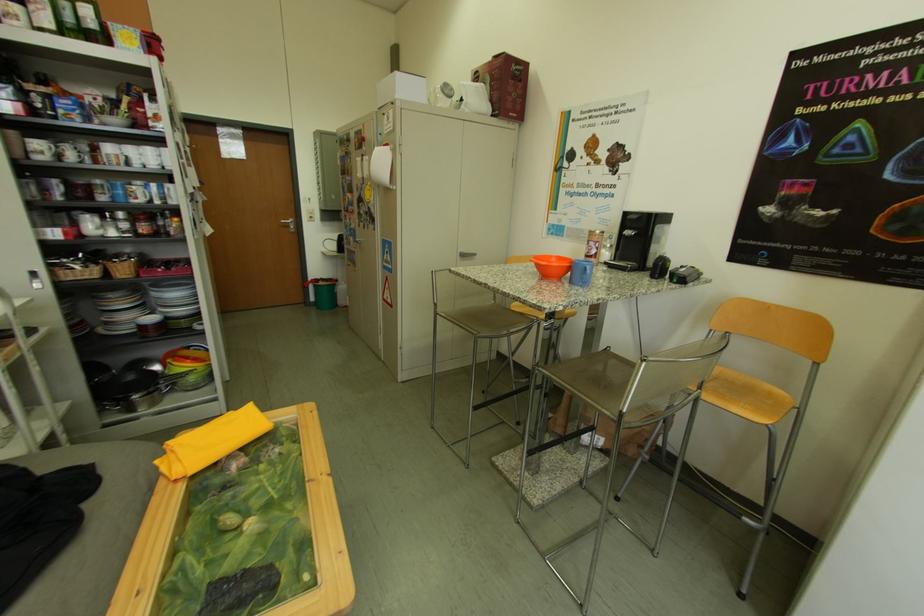
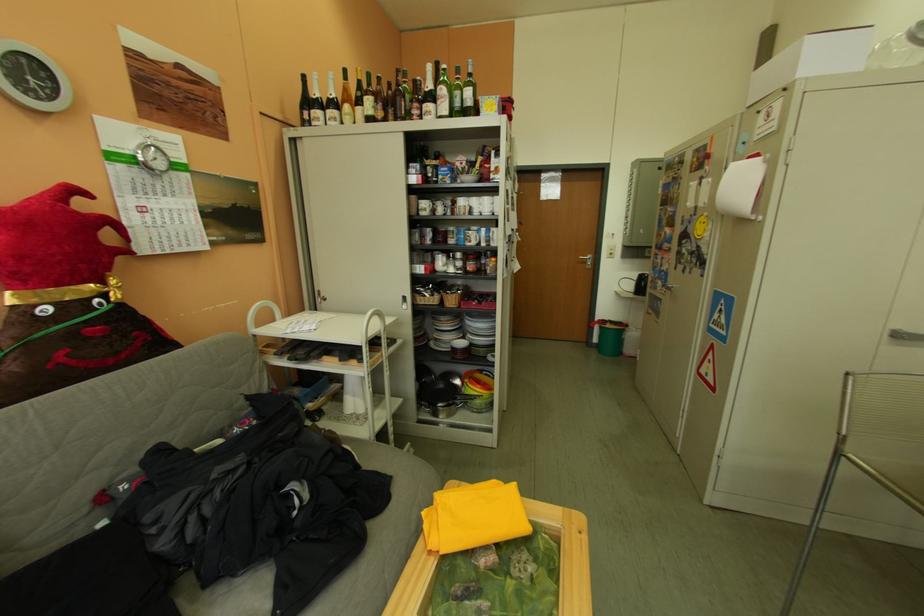
Find the pixel in the second image that matches (x=188, y=386) in the first image.

(478, 405)